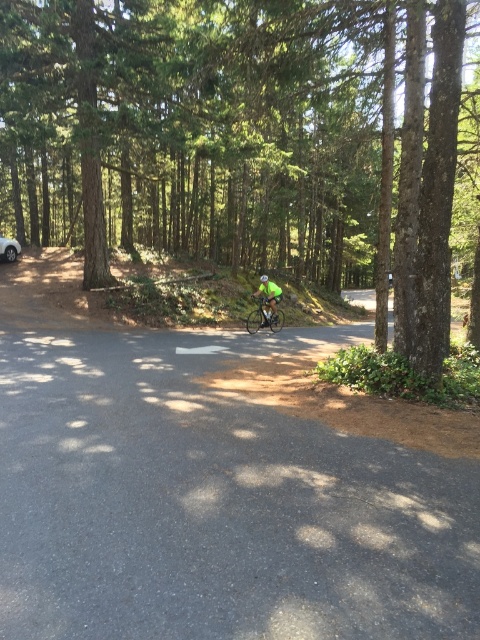
You are standing at the camera position and want to reach the point marked at coordinates (282, 314). If you walk straight ahead, will you reach that point within 25 meters?

The point marked at coordinates (282, 314) is 21.33 meters away from the camera, so yes, you will reach it within 25 meters if you walk straight ahead.

You are a photographer trying to capture the cyclist in the scene. You want to ensure both the shiny metallic bicycle at center and the neon green jersey at center are clearly visible in your photo. Given their positions, which object should you focus on to ensure both are in sharp focus?

The neon green jersey at center is behind the shiny metallic bicycle at center. To ensure both are in sharp focus, you should focus on the shiny metallic bicycle at center since it is closer to the camera, and the neon green jersey at center will be in focus as it is behind it within the depth of field.